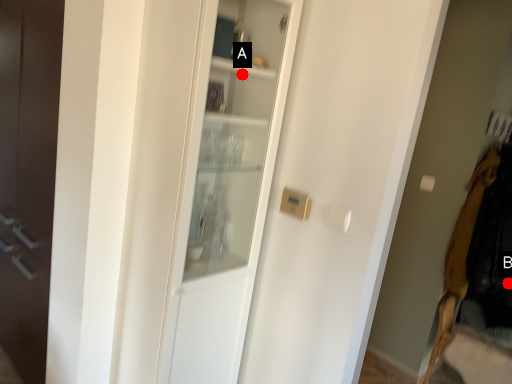
Question: Two points are circled on the image, labeled by A and B beside each circle. Which of the following is the farthest from the observer?

Choices:
 (A) A is further
 (B) B is further

Answer: (B)